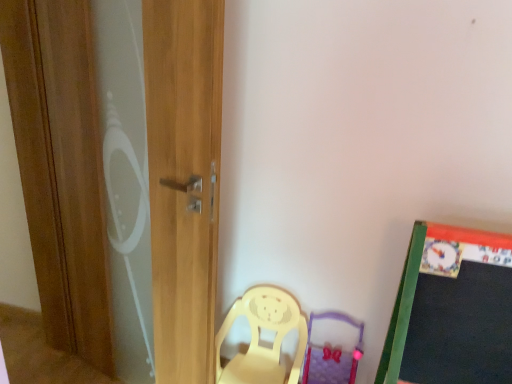
Question: Considering the relative sizes of purple fabric swivel chair at lower center and wooden screen door at left in the image provided, is purple fabric swivel chair at lower center thinner than wooden screen door at left?

Choices:
 (A) yes
 (B) no

Answer: (B)

Question: Is purple fabric swivel chair at lower center with wooden screen door at left?

Choices:
 (A) yes
 (B) no

Answer: (B)

Question: Does purple fabric swivel chair at lower center lie in front of wooden screen door at left?

Choices:
 (A) yes
 (B) no

Answer: (B)

Question: From the image's perspective, is purple fabric swivel chair at lower center beneath wooden screen door at left?

Choices:
 (A) no
 (B) yes

Answer: (B)

Question: Is purple fabric swivel chair at lower center far from wooden screen door at left?

Choices:
 (A) no
 (B) yes

Answer: (B)

Question: From the image's perspective, is purple fabric swivel chair at lower center above or below yellow plastic chair at lower center?

Choices:
 (A) below
 (B) above

Answer: (A)

Question: Which is correct: purple fabric swivel chair at lower center is inside yellow plastic chair at lower center, or outside of it?

Choices:
 (A) outside
 (B) inside

Answer: (A)

Question: Is purple fabric swivel chair at lower center bigger or smaller than yellow plastic chair at lower center?

Choices:
 (A) small
 (B) big

Answer: (A)

Question: Would you say purple fabric swivel chair at lower center is to the left or to the right of yellow plastic chair at lower center in the picture?

Choices:
 (A) right
 (B) left

Answer: (A)

Question: From the image's perspective, is wooden screen door at left above or below yellow plastic chair at lower center?

Choices:
 (A) below
 (B) above

Answer: (B)

Question: Does point (209, 342) appear closer or farther from the camera than point (296, 360)?

Choices:
 (A) farther
 (B) closer

Answer: (B)

Question: From their relative heights in the image, would you say wooden screen door at left is taller or shorter than yellow plastic chair at lower center?

Choices:
 (A) short
 (B) tall

Answer: (B)

Question: Is wooden screen door at left in front of or behind yellow plastic chair at lower center in the image?

Choices:
 (A) behind
 (B) front

Answer: (B)

Question: Is point (323, 352) positioned closer to the camera than point (169, 311)?

Choices:
 (A) closer
 (B) farther

Answer: (B)

Question: Considering their positions, is purple fabric swivel chair at lower center located in front of or behind wooden screen door at left?

Choices:
 (A) front
 (B) behind

Answer: (B)